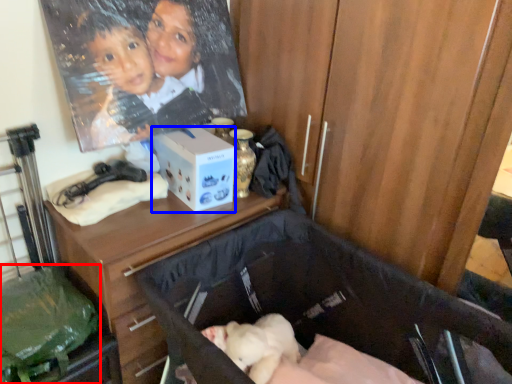
Question: Which object appears farthest to the camera in this image, waste (highlighted by a red box) or box (highlighted by a blue box)?

Choices:
 (A) waste
 (B) box

Answer: (B)